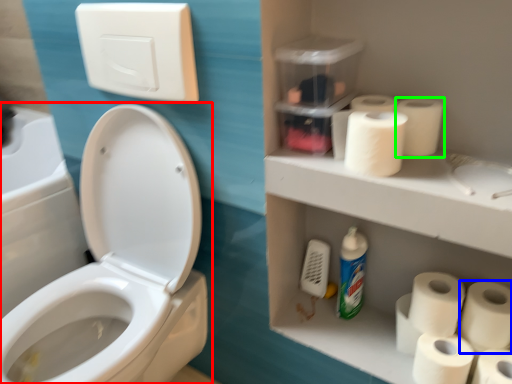
Question: Estimate the real-world distances between objects in this image. Which object is closer to toilet (highlighted by a red box), toilet paper (highlighted by a blue box) or toilet paper (highlighted by a green box)?

Choices:
 (A) toilet paper
 (B) toilet paper

Answer: (B)